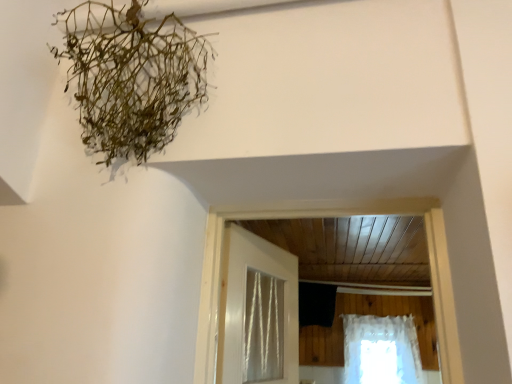
In the scene shown: Measure the distance between green fibrous plant at upper left and camera.

green fibrous plant at upper left is 1.16 meters away from camera.

Locate an element on the screen. The width and height of the screenshot is (512, 384). white glossy door at center is located at coordinates (257, 311).

Is green fibrous plant at upper left shorter than white glossy door at center?

Incorrect, the height of green fibrous plant at upper left does not fall short of that of white glossy door at center.

Do you think green fibrous plant at upper left is within white glossy door at center, or outside of it?

The correct answer is: outside.

Is green fibrous plant at upper left oriented away from white glossy door at center?

Absolutely, green fibrous plant at upper left is directed away from white glossy door at center.

Considering the points (101, 137) and (282, 355), which point is behind, point (101, 137) or point (282, 355)?

Point (282, 355)

How many degrees apart are the facing directions of white glossy door at center and white lace curtain at lower right?

The facing directions of white glossy door at center and white lace curtain at lower right are 72.3 degrees apart.

From the image's perspective, is white glossy door at center over white lace curtain at lower right?

Yes.

Is white glossy door at center in contact with white lace curtain at lower right?

No, white glossy door at center is not beside white lace curtain at lower right.

Is white glossy door at center oriented towards white lace curtain at lower right?

No, white glossy door at center is not aimed at white lace curtain at lower right.

In the scene shown: Between white glossy door at center and green fibrous plant at upper left, which one appears on the left side from the viewer's perspective?

green fibrous plant at upper left.

Do you think white glossy door at center is within green fibrous plant at upper left, or outside of it?

white glossy door at center lies outside green fibrous plant at upper left.

What's the angular difference between white glossy door at center and green fibrous plant at upper left's facing directions?

The angular difference between white glossy door at center and green fibrous plant at upper left is 72.9 degrees.

From a real-world perspective, which is physically above, green fibrous plant at upper left or white lace curtain at lower right?

green fibrous plant at upper left.

Is green fibrous plant at upper left further to camera compared to white lace curtain at lower right?

No, it is not.

Find the location of a particular element. plant above the white lace curtain at lower right (from the image's perspective) is located at coordinates (132, 78).

Can you confirm if green fibrous plant at upper left is taller than white lace curtain at lower right?

Correct, green fibrous plant at upper left is much taller as white lace curtain at lower right.

Can you see white lace curtain at lower right touching green fibrous plant at upper left?

No, white lace curtain at lower right is not with green fibrous plant at upper left.

Is white lace curtain at lower right in front of green fibrous plant at upper left?

No, the depth of white lace curtain at lower right is greater than that of green fibrous plant at upper left.

Can you tell me how much white lace curtain at lower right and green fibrous plant at upper left differ in facing direction?

They differ by 0.598 degrees in their facing directions.

Locate an element on the screen. The width and height of the screenshot is (512, 384). plant on the left of white lace curtain at lower right is located at coordinates (132, 78).

From a real-world perspective, is white lace curtain at lower right positioned above or below white glossy door at center?

From a real-world perspective, white lace curtain at lower right is physically below white glossy door at center.

Is white lace curtain at lower right not within white glossy door at center?

Yes, white lace curtain at lower right is located beyond the bounds of white glossy door at center.

In terms of size, does white lace curtain at lower right appear bigger or smaller than white glossy door at center?

Considering their sizes, white lace curtain at lower right takes up more space than white glossy door at center.

Locate an element on the screen. Image resolution: width=512 pixels, height=384 pixels. door located behind the green fibrous plant at upper left is located at coordinates (257, 311).

Locate an element on the screen. The width and height of the screenshot is (512, 384). curtain on the right side of white glossy door at center is located at coordinates (381, 350).

Based on their spatial positions, is white glossy door at center or white lace curtain at lower right further from green fibrous plant at upper left?

The object further to green fibrous plant at upper left is white lace curtain at lower right.

Considering their positions, is green fibrous plant at upper left positioned closer to white lace curtain at lower right than white glossy door at center?

Based on the image, white glossy door at center appears to be nearer to white lace curtain at lower right.

Which object lies further to the anchor point white glossy door at center, green fibrous plant at upper left or white lace curtain at lower right?

The object further to white glossy door at center is white lace curtain at lower right.

Considering their positions, is white lace curtain at lower right positioned closer to white glossy door at center than green fibrous plant at upper left?

Based on the image, green fibrous plant at upper left appears to be nearer to white glossy door at center.

Estimate the real-world distances between objects in this image. Which object is further from green fibrous plant at upper left, white lace curtain at lower right or white glossy door at center?

white lace curtain at lower right is further to green fibrous plant at upper left.

When comparing their distances from white lace curtain at lower right, does white glossy door at center or green fibrous plant at upper left seem further?

green fibrous plant at upper left lies further to white lace curtain at lower right than the other object.

Image resolution: width=512 pixels, height=384 pixels. What are the coordinates of `door between green fibrous plant at upper left and white lace curtain at lower right along the z-axis` in the screenshot? It's located at (257, 311).